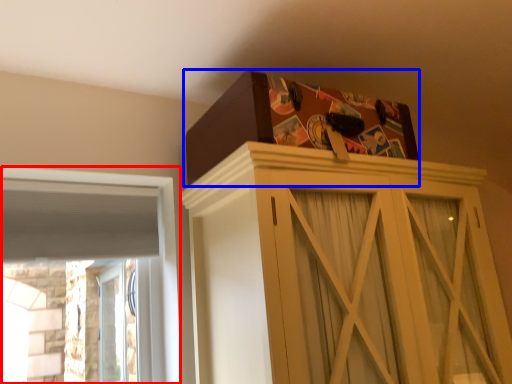
Question: Which point is closer to the camera, window (highlighted by a red box) or cardboard box (highlighted by a blue box)?

Choices:
 (A) window
 (B) cardboard box

Answer: (B)